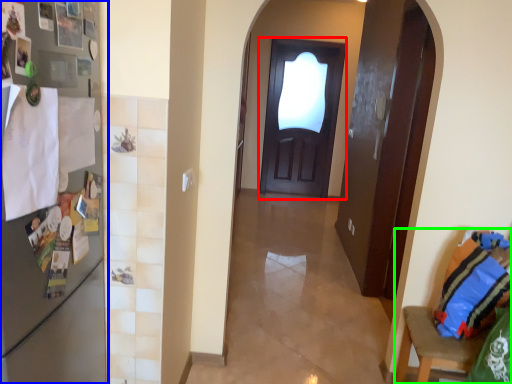
Question: Considering the real-world distances, which object is closest to door (highlighted by a red box)? fridge (highlighted by a blue box) or armchair (highlighted by a green box).

Choices:
 (A) fridge
 (B) armchair

Answer: (B)